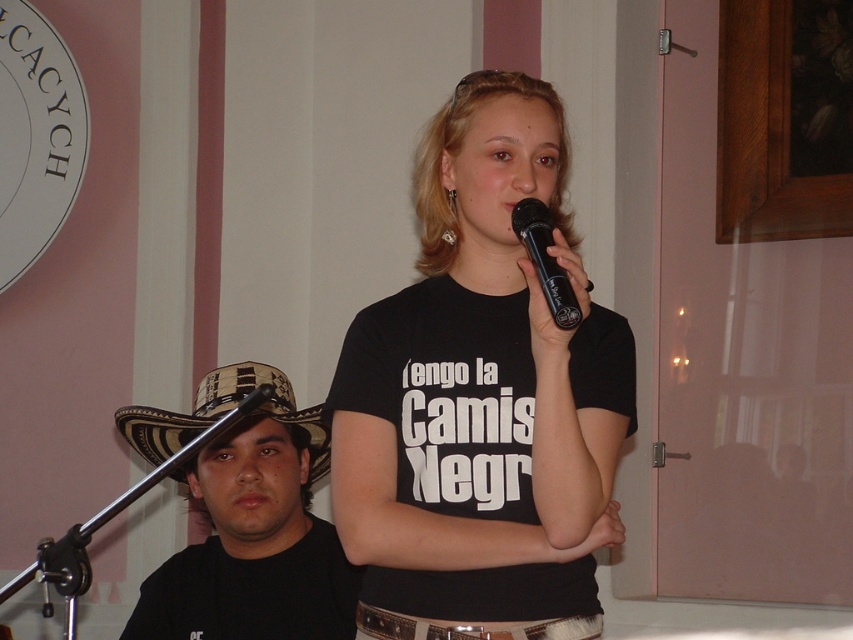
Can you confirm if black matte shirt at center is shorter than black matte hat at left?

No.

Is black matte shirt at center positioned behind black matte hat at left?

No, black matte shirt at center is closer to the viewer.

Find the location of a particular element. The height and width of the screenshot is (640, 853). black matte shirt at center is located at coordinates (480, 396).

Can you confirm if black matte hat at left is smaller than woven straw cowboy hat at left?

No.

Is point (195, 417) more distant than point (289, 417)?

No, it is in front of (289, 417).

Image resolution: width=853 pixels, height=640 pixels. I want to click on black matte hat at left, so click(x=245, y=518).

Does black matte hat at left have a greater width compared to black plastic microphone at upper center?

Indeed, black matte hat at left has a greater width compared to black plastic microphone at upper center.

Is black matte hat at left taller than black plastic microphone at upper center?

Indeed, black matte hat at left has a greater height compared to black plastic microphone at upper center.

What do you see at coordinates (245, 518) in the screenshot?
I see `black matte hat at left` at bounding box center [245, 518].

Find the location of a particular element. The image size is (853, 640). black matte hat at left is located at coordinates (245, 518).